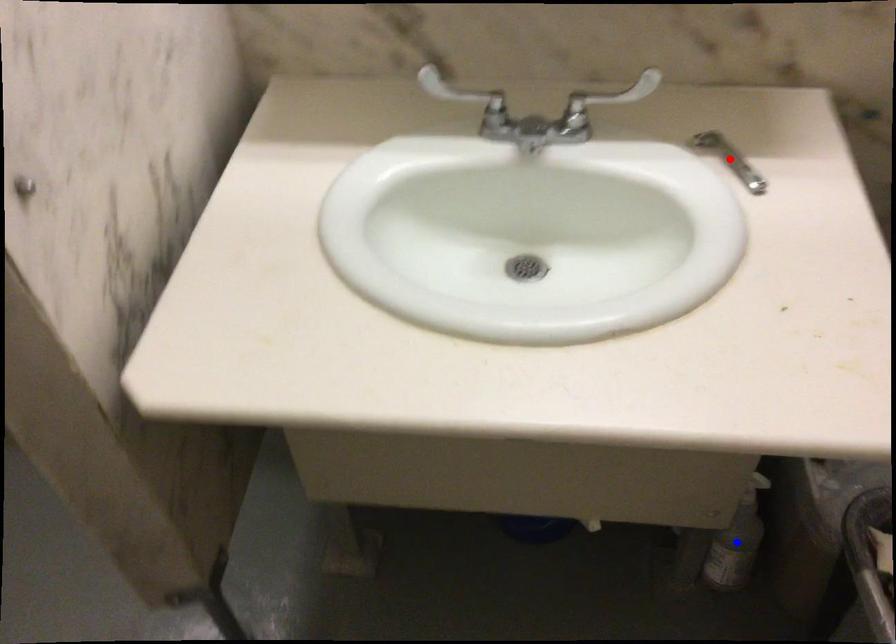
Question: Two points are marked on the image. Which point is closer to the camera?

Choices:
 (A) Blue point is closer.
 (B) Red point is closer.

Answer: (B)